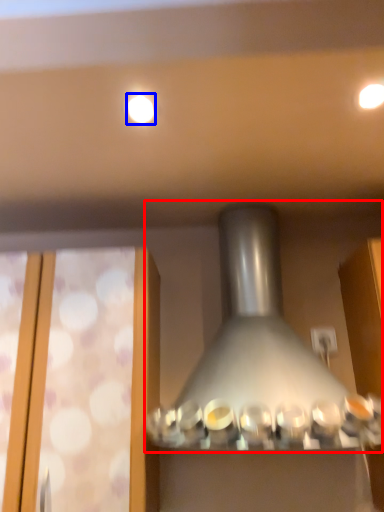
Question: Which point is closer to the camera, lamp (highlighted by a red box) or lighting (highlighted by a blue box)?

Choices:
 (A) lamp
 (B) lighting

Answer: (A)